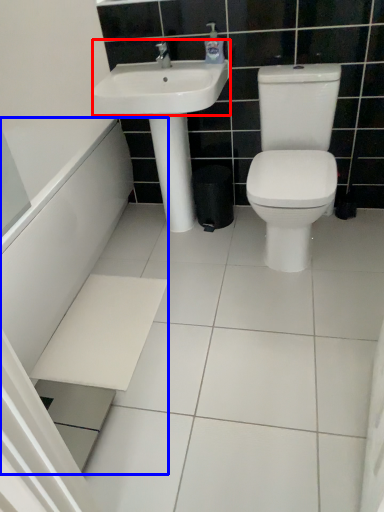
Question: Which of the following is the closest to the observer, sink (highlighted by a red box) or bath (highlighted by a blue box)?

Choices:
 (A) sink
 (B) bath

Answer: (B)